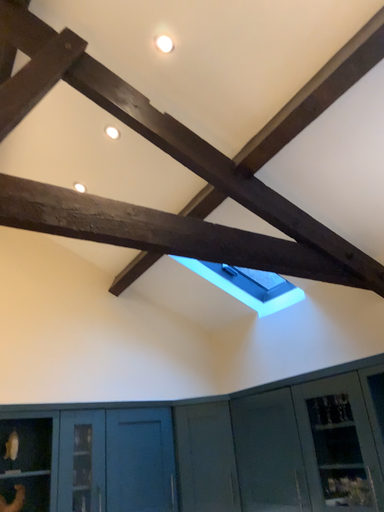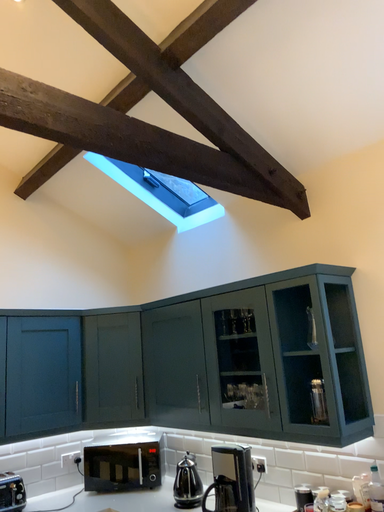
Question: Which way did the camera rotate in the video?

Choices:
 (A) rotated upward
 (B) rotated downward

Answer: (B)